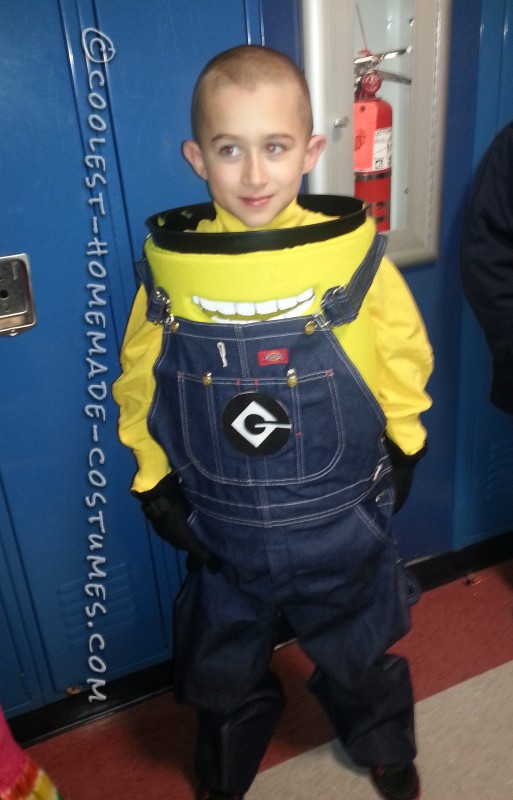
The width and height of the screenshot is (513, 800). What are the coordinates of `locker` in the screenshot? It's located at (49, 177).